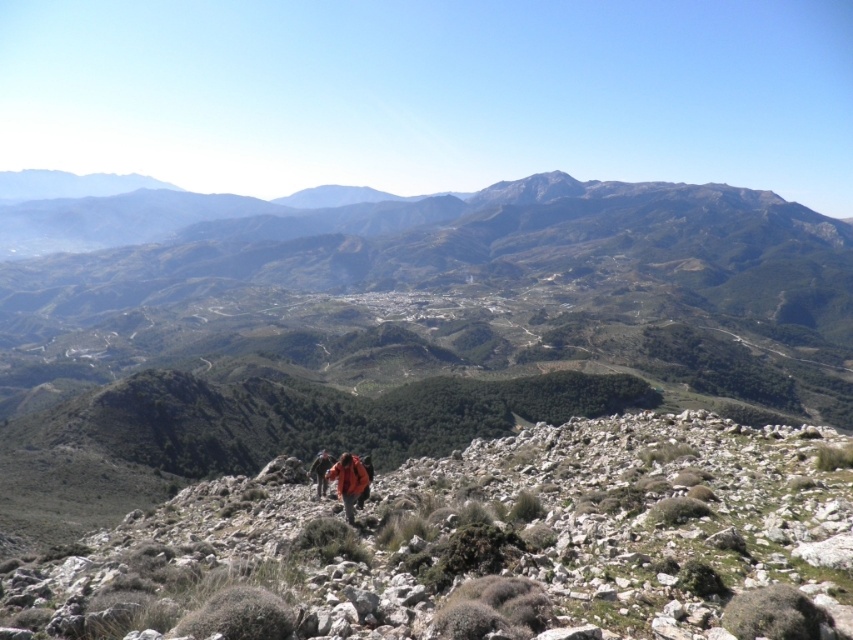
You are a hiker trying to locate your belongings. You see an orange fabric jacket at center and an orange fabric backpack at center. Which item is nearer to you?

The orange fabric jacket at center is closer to the viewer than the orange fabric backpack at center.

You are a hiker looking for your belongings. You see an orange fabric jacket at center and an orange fabric backpack at center. Which item is positioned higher up the slope?

The orange fabric jacket at center is located above the orange fabric backpack at center, so the jacket is higher up the slope.

You are a hiker who has just reached the summit and is looking down at the orange fabric jacket at center and the orange fabric backpack at center. Which one is more to the right?

The orange fabric jacket at center is more to the right because it is positioned on the right side of the orange fabric backpack at center.